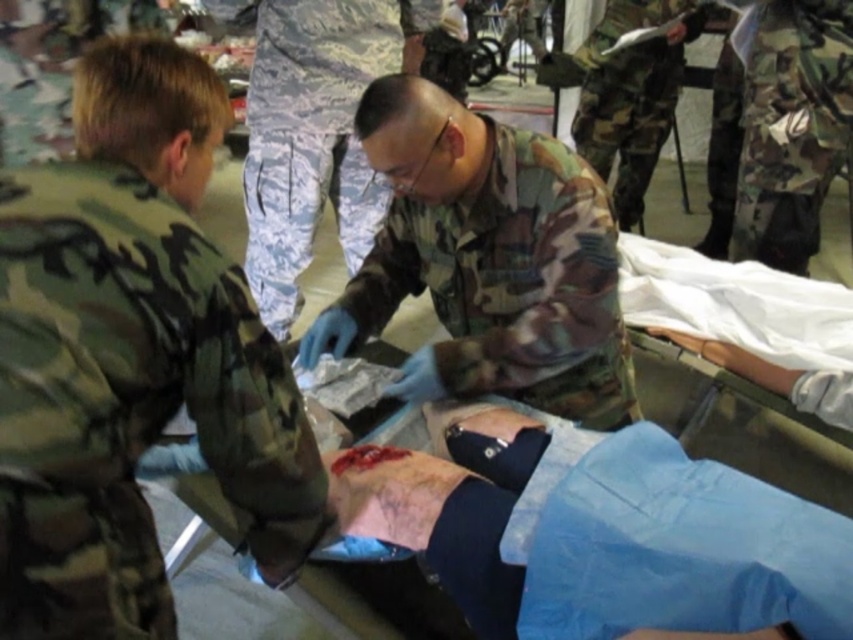
Question: Does digital camouflage pants at center have a greater width compared to camouflage fabric uniform at upper center?

Choices:
 (A) yes
 (B) no

Answer: (A)

Question: Which of the following is the closest to the observer?

Choices:
 (A) (672, 67)
 (B) (572, 321)

Answer: (B)

Question: In this image, where is camouflage fabric at center located relative to camouflage fabric uniform at upper center?

Choices:
 (A) left
 (B) right

Answer: (A)

Question: Which of the following is the closest to the observer?

Choices:
 (A) camouflage fabric at center
 (B) camouflage fabric pants at right
 (C) camouflage fabric at left
 (D) digital camouflage pants at center

Answer: (C)

Question: Can you confirm if camouflage fabric at center is positioned to the left of digital camouflage pants at center?

Choices:
 (A) yes
 (B) no

Answer: (B)

Question: Which is nearer to the camouflage fabric uniform at upper center?

Choices:
 (A) camouflage fabric at left
 (B) digital camouflage pants at center
 (C) camouflage fabric pants at right

Answer: (C)